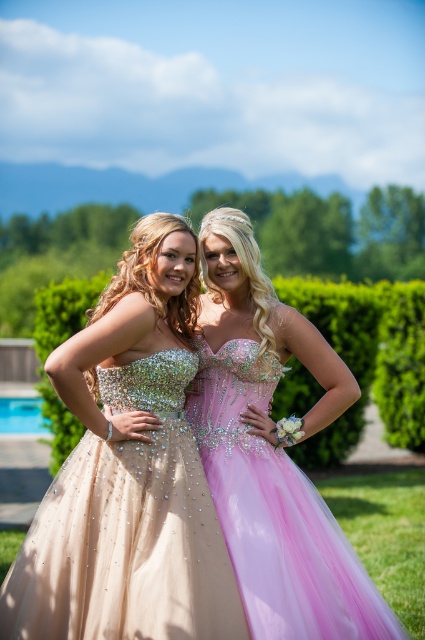
Between pink tulle dress at center and green leafy hedge at center, which one is positioned higher?

→ green leafy hedge at center is above.

Which is in front, point (292, 465) or point (357, 300)?

Point (292, 465)

Locate an element on the screen. Image resolution: width=425 pixels, height=640 pixels. pink tulle dress at center is located at coordinates (275, 513).

Is sparkly beige dress at center bigger than green leafy hedge at center?

Actually, sparkly beige dress at center might be smaller than green leafy hedge at center.

Is point (209, 634) behind point (314, 452)?

No.

Is point (138, 467) positioned behind point (390, 372)?

No, it is in front of (390, 372).

Find the location of a particular element. This screenshot has height=640, width=425. sparkly beige dress at center is located at coordinates (127, 531).

Between green leafy hedge at center and blue glass pool at lower left, which one appears on the left side from the viewer's perspective?

blue glass pool at lower left

Who is more distant from viewer, (48, 337) or (5, 420)?

Point (5, 420)

Identify the location of green leafy hedge at center. (367, 356).